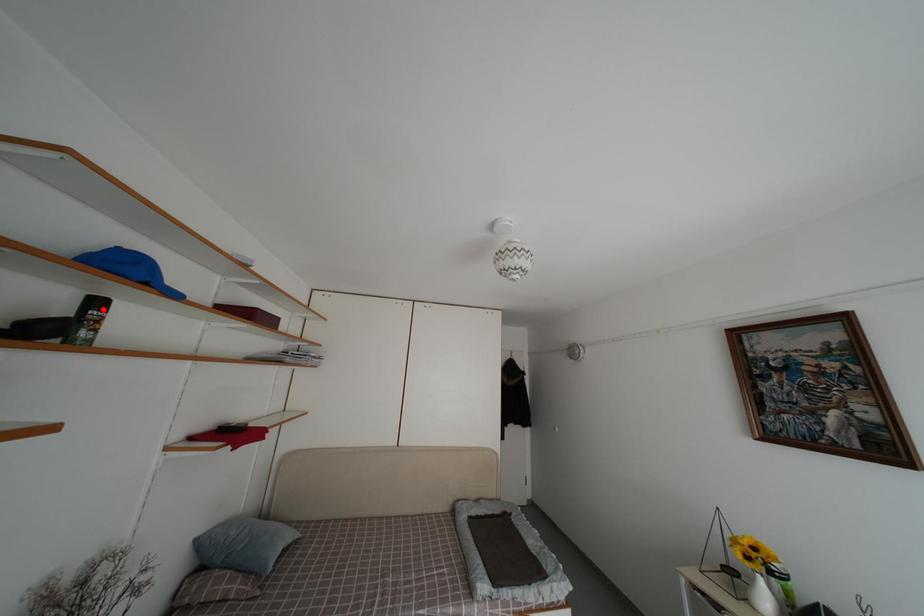
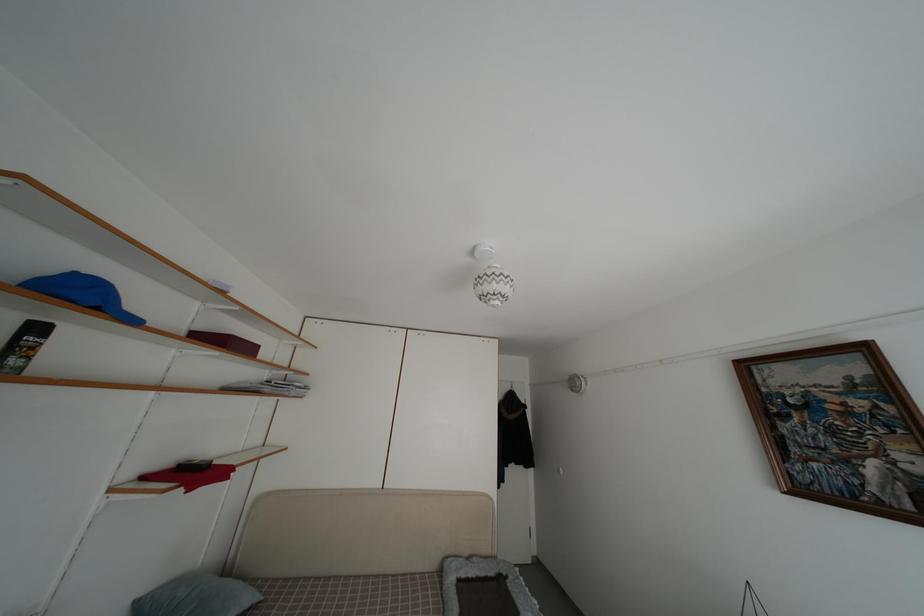
Find the pixel in the second image that matches the highlighted location in the first image.

(43, 334)